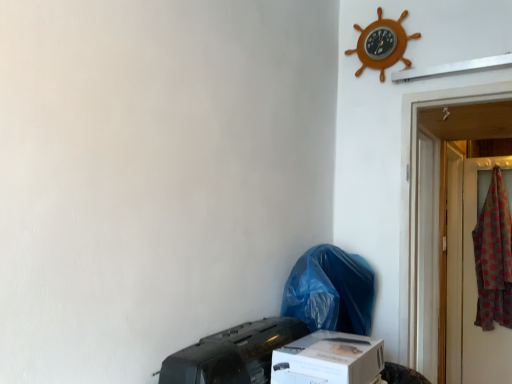
Question: Is blue plastic bag at lower center to the left or to the right of white cardboard box at lower center in the image?

Choices:
 (A) right
 (B) left

Answer: (A)

Question: From the image's perspective, is blue plastic bag at lower center positioned above or below white cardboard box at lower center?

Choices:
 (A) above
 (B) below

Answer: (A)

Question: Estimate the real-world distances between objects in this image. Which object is farther from the white cardboard box at lower center?

Choices:
 (A) blue plastic bag at lower center
 (B) wooden ship wheel at upper right
 (C) black matte printer at lower center
 (D) polka dot fabric at right

Answer: (D)

Question: Estimate the real-world distances between objects in this image. Which object is farther from the white cardboard box at lower center?

Choices:
 (A) black matte printer at lower center
 (B) wooden ship wheel at upper right
 (C) polka dot fabric at right
 (D) blue plastic bag at lower center

Answer: (C)